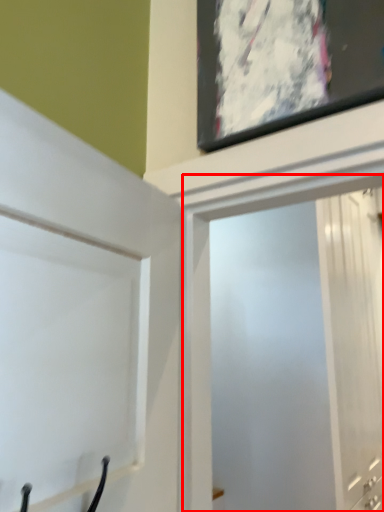
Question: From the image's perspective, what is the correct spatial positioning of screen door (annotated by the red box) in reference to door?

Choices:
 (A) below
 (B) above

Answer: (A)